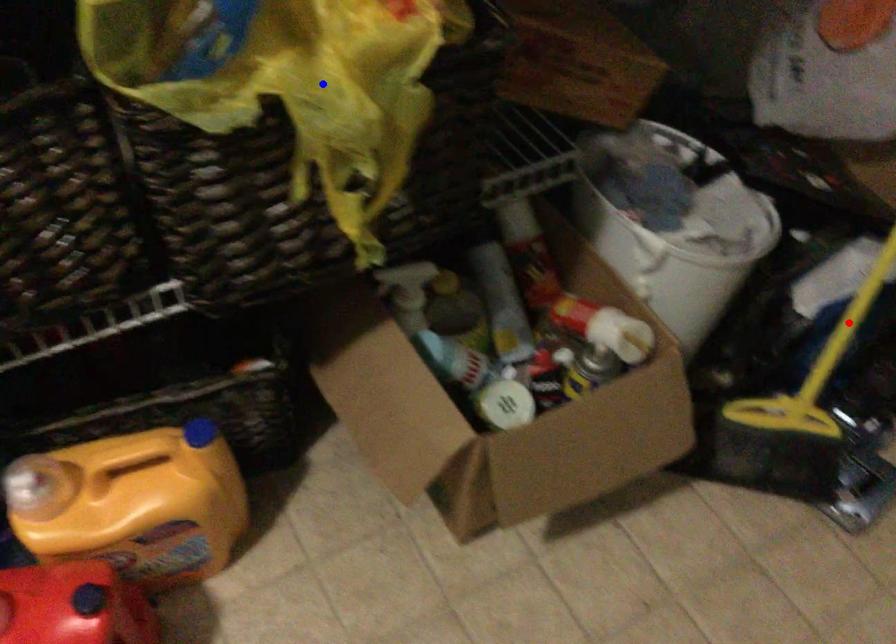
Question: Which of the two points in the image is closer to the camera?

Choices:
 (A) Blue point is closer.
 (B) Red point is closer.

Answer: (A)